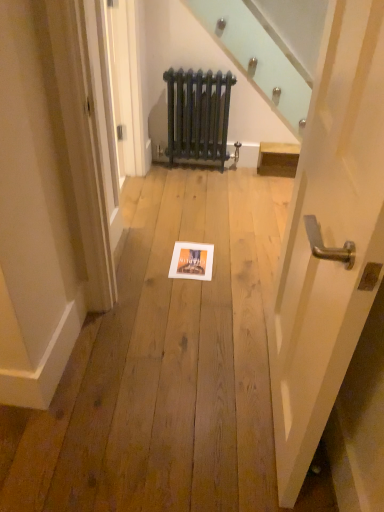
At what (x,y) coordinates should I click in order to perform the action: click on blank space situated above matte white picture frame at center (from a real-world perspective). Please return your answer as a coordinate pair (x, y). Looking at the image, I should click on 189,253.